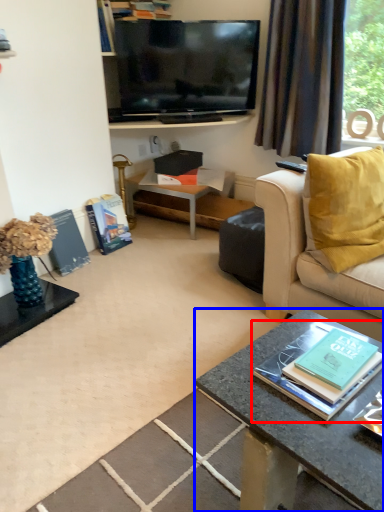
Question: Among these objects, which one is farthest to the camera, book (highlighted by a red box) or desk (highlighted by a blue box)?

Choices:
 (A) book
 (B) desk

Answer: (A)